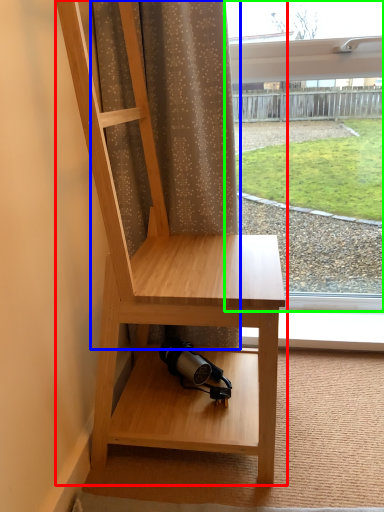
Question: Considering the real-world distances, which object is farthest from furniture (highlighted by a red box)? curtain (highlighted by a blue box) or window (highlighted by a green box)?

Choices:
 (A) curtain
 (B) window

Answer: (B)